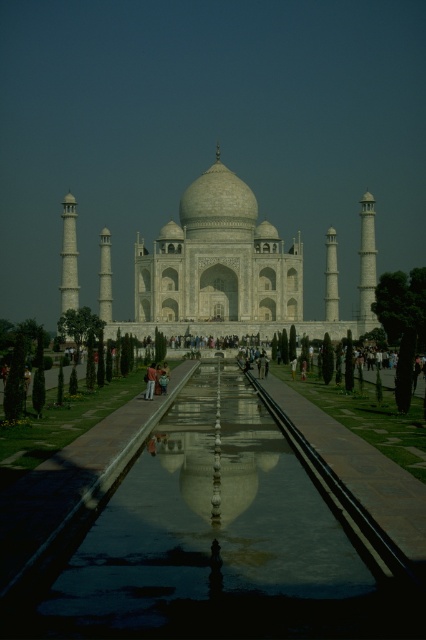
You are standing in front of the Taj Mahal and want to take a photo that includes both the Taj Mahal and its reflection in the glossy reflective pool at center. Based on the coordinates provided, where should you position yourself to ensure the reflection is fully visible in the frame?

You should position yourself at point (187,531) to ensure the reflection of the Taj Mahal in the glossy reflective pool at center is fully visible in the frame.

You are standing in front of the Taj Mahal and want to take a photo that includes both the white marble taj mahal at center and the reflecting pool in front of it. Based on your distance from the monument, will you be able to capture both in a single frame without moving closer or farther away?

The white marble taj mahal at center is 372.55 feet from viewer. Since the reflecting pool is in front of the Taj Mahal, it would be closer to you than the monument. As long as your camera has a wide enough angle, you can capture both in one frame without needing to adjust your position.

You are a tourist standing in front of the Taj Mahal and want to take a photo that includes both the glossy reflective pool at center and the white marble Taj Mahal at center. Based on their positions, which one should you focus on first to ensure both are in frame?

The glossy reflective pool at center is in front of the white marble Taj Mahal at center, so you should focus on the glossy reflective pool at center first to ensure both are in frame since it is closer to you.